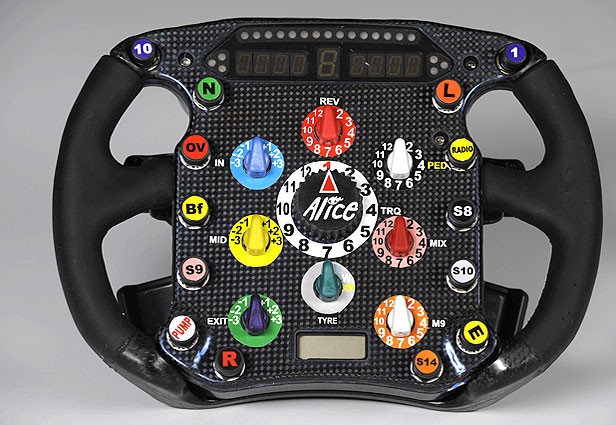
Find the location of a particular element. Image resolution: width=616 pixels, height=425 pixels. radio (text) is located at coordinates (463, 148).